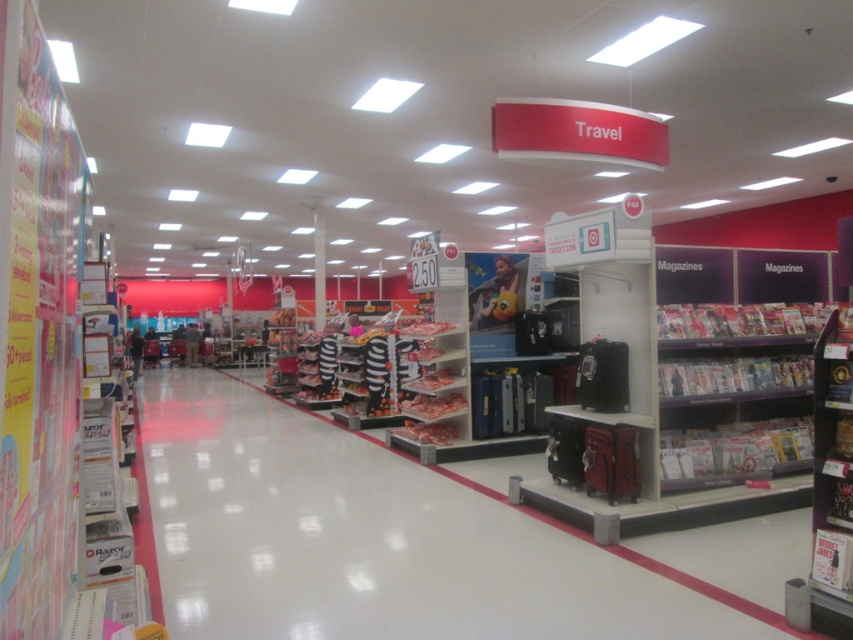
Question: Where is metallic suitcase at center located in relation to hardcover book at center in the image?

Choices:
 (A) above
 (B) below

Answer: (B)

Question: Which object is farther from the camera taking this photo?

Choices:
 (A) metallic silver magazines at lower right
 (B) hardcover book at center
 (C) metallic suitcase at center

Answer: (A)

Question: Among these points, which one is nearest to the camera?

Choices:
 (A) (538, 561)
 (B) (798, 378)

Answer: (A)

Question: Which object is farther from the camera taking this photo?

Choices:
 (A) metallic silver magazines at lower right
 (B) metallic suitcase at center
 (C) hardcover book at center

Answer: (A)

Question: From the image, what is the correct spatial relationship of hardcover book at center in relation to metallic silver magazines at lower right?

Choices:
 (A) right
 (B) left

Answer: (B)

Question: Is metallic suitcase at center positioned in front of hardcover book at center?

Choices:
 (A) yes
 (B) no

Answer: (B)